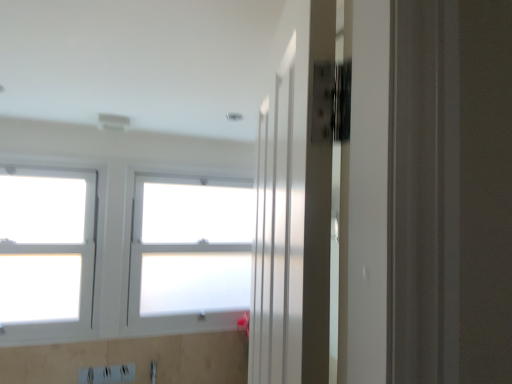
The width and height of the screenshot is (512, 384). I want to click on white glass window at left, the first window in the left-to-right sequence, so click(x=46, y=252).

What do you see at coordinates (46, 252) in the screenshot? I see `white glass window at left, the second window from the right` at bounding box center [46, 252].

From the picture: What is the approximate height of white glass window at left, the second window from the right?

The height of white glass window at left, the second window from the right, is 3.33 feet.

Measure the distance between point (198,219) and camera.

The depth of point (198,219) is 2.74 meters.

The height and width of the screenshot is (384, 512). I want to click on white frosted glass window at center, which is counted as the second window, starting from the left, so click(x=189, y=256).

This screenshot has width=512, height=384. Describe the element at coordinates (189, 256) in the screenshot. I see `white frosted glass window at center, the first window viewed from the right` at that location.

Identify the location of white glass window at left, the first window in the left-to-right sequence. Image resolution: width=512 pixels, height=384 pixels. (46, 252).

Considering the positions of objects white glass window at left, the first window in the left-to-right sequence, and white frosted glass window at center, the first window viewed from the right, in the image provided, who is more to the left, white glass window at left, the first window in the left-to-right sequence, or white frosted glass window at center, the first window viewed from the right,?

white glass window at left, the first window in the left-to-right sequence, is more to the left.

Is white glass window at left, the first window in the left-to-right sequence, further to camera compared to white frosted glass window at center, the first window viewed from the right?

That is False.

Is point (93, 172) closer or farther from the camera than point (231, 236)?

Clearly, point (93, 172) is closer to the camera than point (231, 236).

From the image's perspective, which one is positioned higher, white glass window at left, the second window from the right, or white frosted glass window at center, the first window viewed from the right?

white glass window at left, the second window from the right, appears higher in the image.

From a real-world perspective, between white glass window at left, the first window in the left-to-right sequence, and white frosted glass window at center, the first window viewed from the right, who is vertically higher?

white glass window at left, the first window in the left-to-right sequence.

Looking at their sizes, would you say white glass window at left, the first window in the left-to-right sequence, is wider or thinner than white frosted glass window at center, which is counted as the second window, starting from the left?

In the image, white glass window at left, the first window in the left-to-right sequence, appears to be more narrow than white frosted glass window at center, which is counted as the second window, starting from the left.

Who is taller, white glass window at left, the second window from the right, or white frosted glass window at center, which is counted as the second window, starting from the left?

With more height is white glass window at left, the second window from the right.

Which of these two, white glass window at left, the second window from the right, or white frosted glass window at center, which is counted as the second window, starting from the left, is smaller?

white glass window at left, the second window from the right.

Is white frosted glass window at center, which is counted as the second window, starting from the left, surrounded by white glass window at left, the second window from the right?

Actually, white frosted glass window at center, which is counted as the second window, starting from the left, is outside white glass window at left, the second window from the right.

Does white glass window at left, the first window in the left-to-right sequence, touch white frosted glass window at center, the first window viewed from the right?

They are not placed beside each other.

Is white glass window at left, the second window from the right, looking in the opposite direction of white frosted glass window at center, the first window viewed from the right?

No, white glass window at left, the second window from the right, is not facing away from white frosted glass window at center, the first window viewed from the right.

The width and height of the screenshot is (512, 384). Identify the location of window below the white glass window at left, the first window in the left-to-right sequence (from a real-world perspective). (189, 256).

Can you confirm if white frosted glass window at center, the first window viewed from the right, is positioned to the right of white glass window at left, the first window in the left-to-right sequence?

Yes, white frosted glass window at center, the first window viewed from the right, is to the right of white glass window at left, the first window in the left-to-right sequence.

Which is behind, white frosted glass window at center, the first window viewed from the right, or white glass window at left, the second window from the right?

white frosted glass window at center, the first window viewed from the right.

Considering the positions of points (229, 324) and (48, 213), is point (229, 324) farther from camera compared to point (48, 213)?

That is True.

From the image's perspective, which one is positioned lower, white frosted glass window at center, which is counted as the second window, starting from the left, or white glass window at left, the second window from the right?

white frosted glass window at center, which is counted as the second window, starting from the left.

From a real-world perspective, relative to white glass window at left, the first window in the left-to-right sequence, is white frosted glass window at center, the first window viewed from the right, vertically above or below?

Clearly, from a real-world perspective, white frosted glass window at center, the first window viewed from the right, is below white glass window at left, the first window in the left-to-right sequence.

Considering the relative sizes of white frosted glass window at center, which is counted as the second window, starting from the left, and white glass window at left, the first window in the left-to-right sequence, in the image provided, is white frosted glass window at center, which is counted as the second window, starting from the left, wider than white glass window at left, the first window in the left-to-right sequence,?

No, white frosted glass window at center, which is counted as the second window, starting from the left, is not wider than white glass window at left, the first window in the left-to-right sequence.

Considering the relative sizes of white frosted glass window at center, the first window viewed from the right, and white glass window at left, the first window in the left-to-right sequence, in the image provided, is white frosted glass window at center, the first window viewed from the right, shorter than white glass window at left, the first window in the left-to-right sequence,?

Correct, white frosted glass window at center, the first window viewed from the right, is not as tall as white glass window at left, the first window in the left-to-right sequence.

Does white frosted glass window at center, the first window viewed from the right, have a smaller size compared to white glass window at left, the first window in the left-to-right sequence?

Actually, white frosted glass window at center, the first window viewed from the right, might be larger than white glass window at left, the first window in the left-to-right sequence.

Would you say white frosted glass window at center, the first window viewed from the right, is inside or outside white glass window at left, the first window in the left-to-right sequence?

white frosted glass window at center, the first window viewed from the right, is not enclosed by white glass window at left, the first window in the left-to-right sequence.

Is white frosted glass window at center, which is counted as the second window, starting from the left, in contact with white glass window at left, the second window from the right?

white frosted glass window at center, which is counted as the second window, starting from the left, and white glass window at left, the second window from the right, are not in contact.

From the picture: Is white glass window at left, the first window in the left-to-right sequence, at the back of white frosted glass window at center, the first window viewed from the right?

white frosted glass window at center, the first window viewed from the right, does not have its back to white glass window at left, the first window in the left-to-right sequence.

Locate an element on the screen. window above the white frosted glass window at center, the first window viewed from the right (from a real-world perspective) is located at coordinates pos(46,252).

At what (x,y) coordinates should I click in order to perform the action: click on window on the right side of white glass window at left, the second window from the right. Please return your answer as a coordinate pair (x, y). Image resolution: width=512 pixels, height=384 pixels. Looking at the image, I should click on (189, 256).

Where is `window in front of the white frosted glass window at center, which is counted as the second window, starting from the left`? Image resolution: width=512 pixels, height=384 pixels. window in front of the white frosted glass window at center, which is counted as the second window, starting from the left is located at coordinates (x=46, y=252).